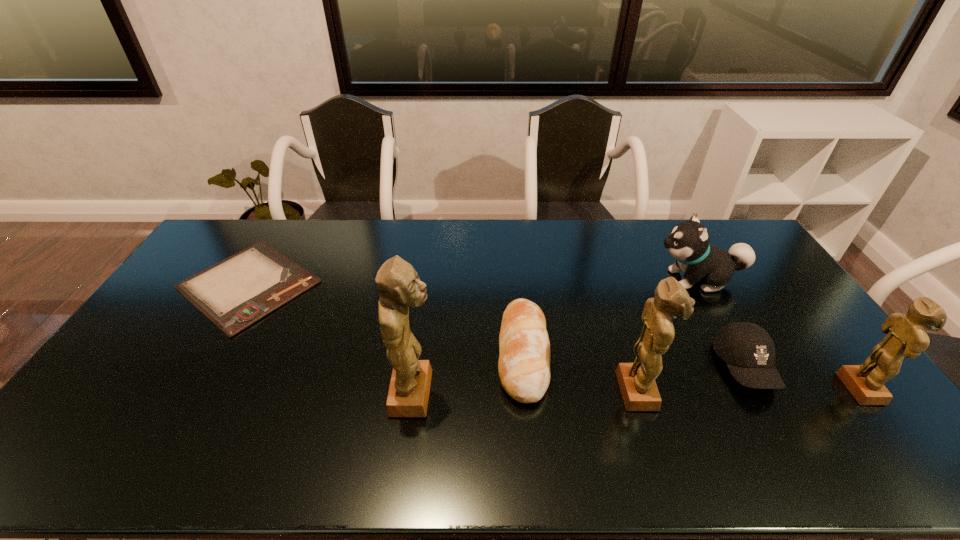
Where is `object that is the fourth closest to the baseball cap`? This screenshot has width=960, height=540. object that is the fourth closest to the baseball cap is located at coordinates (524, 361).

Point out which figurine is positioned as the third nearest to the clipboard. Please provide its 2D coordinates. Your answer should be formatted as a tuple, i.e. [(x, y)], where the tuple contains the x and y coordinates of a point satisfying the conditions above.

[(906, 336)]

Identify which figurine is the second closest to the second object from left to right. Please provide its 2D coordinates. Your answer should be formatted as a tuple, i.e. [(x, y)], where the tuple contains the x and y coordinates of a point satisfying the conditions above.

[(906, 336)]

The height and width of the screenshot is (540, 960). In order to click on vacant position in the image that satisfies the following two spatial constraints: 1. on the front-facing side of the baseball cap; 2. on the front-facing side of the leftmost figurine in this screenshot , I will do `click(759, 393)`.

You are a GUI agent. You are given a task and a screenshot of the screen. Output one action in this format:
    pyautogui.click(x=<x>, y=<y>)
    Task: Click on the vacant space that satisfies the following two spatial constraints: 1. on the front-facing side of the baseball cap; 2. on the front-facing side of the second object from left to right
    The image size is (960, 540).
    Given the screenshot: What is the action you would take?
    [x=759, y=393]